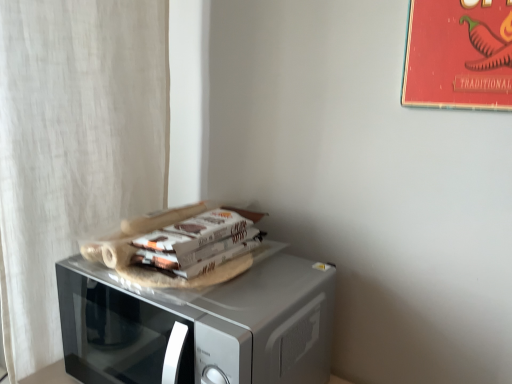
Question: Can you confirm if white textured curtain at left is smaller than silver metallic microwave at center?

Choices:
 (A) no
 (B) yes

Answer: (A)

Question: From the image's perspective, is white textured curtain at left over silver metallic microwave at center?

Choices:
 (A) yes
 (B) no

Answer: (A)

Question: Would you say white textured curtain at left contains silver metallic microwave at center?

Choices:
 (A) no
 (B) yes

Answer: (A)

Question: Is white textured curtain at left turned away from silver metallic microwave at center?

Choices:
 (A) yes
 (B) no

Answer: (A)

Question: Can you confirm if white textured curtain at left is wider than silver metallic microwave at center?

Choices:
 (A) yes
 (B) no

Answer: (B)

Question: Is white textured curtain at left bigger than silver metallic microwave at center?

Choices:
 (A) no
 (B) yes

Answer: (B)

Question: From a real-world perspective, is red paper poster at upper right on silver metallic microwave at center?

Choices:
 (A) yes
 (B) no

Answer: (A)

Question: Considering the relative sizes of red paper poster at upper right and silver metallic microwave at center in the image provided, is red paper poster at upper right wider than silver metallic microwave at center?

Choices:
 (A) yes
 (B) no

Answer: (B)

Question: From the image's perspective, is red paper poster at upper right below silver metallic microwave at center?

Choices:
 (A) no
 (B) yes

Answer: (A)

Question: Does red paper poster at upper right have a larger size compared to silver metallic microwave at center?

Choices:
 (A) yes
 (B) no

Answer: (B)

Question: Is there a large distance between red paper poster at upper right and silver metallic microwave at center?

Choices:
 (A) yes
 (B) no

Answer: (B)

Question: Is red paper poster at upper right turned away from silver metallic microwave at center?

Choices:
 (A) yes
 (B) no

Answer: (B)

Question: Does silver metallic microwave at center turn towards red paper poster at upper right?

Choices:
 (A) no
 (B) yes

Answer: (A)